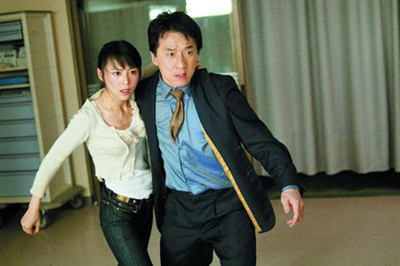
This screenshot has width=400, height=266. What are the coordinates of `wall` in the screenshot? It's located at (237, 32), (64, 57), (79, 165).